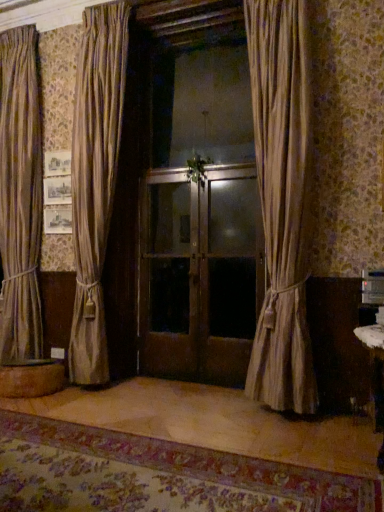
Image resolution: width=384 pixels, height=512 pixels. What do you see at coordinates (199, 273) in the screenshot?
I see `wooden door at center` at bounding box center [199, 273].

The height and width of the screenshot is (512, 384). What are the coordinates of `matte brown curtain at center, the first curtain from the left` in the screenshot? It's located at (95, 179).

Measure the distance between point (286, 92) and camera.

Point (286, 92) and camera are 9.47 feet apart from each other.

You are a GUI agent. You are given a task and a screenshot of the screen. Output one action in this format:
    pyautogui.click(x=<x>, y=<y>)
    Task: Click on the wooden door at center
    The width and height of the screenshot is (384, 512).
    Given the screenshot: What is the action you would take?
    pyautogui.click(x=199, y=273)

What's the angular difference between matte brown curtain at center, the first curtain from the left, and silky beige curtain at center, which is the second curtain in back-to-front order,'s facing directions?

There is a 9.12-degree angle between the facing directions of matte brown curtain at center, the first curtain from the left, and silky beige curtain at center, which is the second curtain in back-to-front order.

Does matte brown curtain at center, placed as the second curtain when sorted from front to back, have a larger size compared to silky beige curtain at center, positioned as the 1th curtain in front-to-back order?

No, matte brown curtain at center, placed as the second curtain when sorted from front to back, is not bigger than silky beige curtain at center, positioned as the 1th curtain in front-to-back order.

Is matte brown curtain at center, the first curtain from the left, far away from silky beige curtain at center, marked as the 1th curtain in a right-to-left arrangement?

Yes.

Between matte brown curtain at center, the 2th curtain positioned from the right, and silky beige curtain at center, which is the second curtain in back-to-front order, which one has more height?

matte brown curtain at center, the 2th curtain positioned from the right.

Is wooden door at center surrounded by silky beige curtain at center, marked as the 1th curtain in a right-to-left arrangement?

No, wooden door at center is not surrounded by silky beige curtain at center, marked as the 1th curtain in a right-to-left arrangement.

How far apart are silky beige curtain at center, marked as the 1th curtain in a right-to-left arrangement, and wooden door at center?

silky beige curtain at center, marked as the 1th curtain in a right-to-left arrangement, is 29.46 inches from wooden door at center.

Does point (266, 83) appear closer or farther from the camera than point (245, 350)?

Point (266, 83).

Considering the sizes of objects silky beige curtain at center, which is the second curtain in back-to-front order, and wooden door at center in the image provided, who is taller, silky beige curtain at center, which is the second curtain in back-to-front order, or wooden door at center?

silky beige curtain at center, which is the second curtain in back-to-front order, is taller.

Between point (179, 364) and point (70, 360), which one is positioned in front?

The point (70, 360) is in front.

Is wooden door at center at the right side of matte brown curtain at center, the 2th curtain positioned from the right?

Yes.

Considering the sizes of wooden door at center and matte brown curtain at center, the first curtain from the left, in the image, is wooden door at center taller or shorter than matte brown curtain at center, the first curtain from the left,?

In the image, wooden door at center appears to be shorter than matte brown curtain at center, the first curtain from the left.

Which is behind, wooden door at center or matte brown curtain at center, the 2th curtain positioned from the right?

wooden door at center is further from the camera.

Is point (177, 180) positioned before point (249, 227)?

No, it is not.

Would you say brown wooden screen door at center, the 1th screen door positioned from the left, contains wooden door at center?

That's correct, wooden door at center is inside brown wooden screen door at center, the 1th screen door positioned from the left.

The image size is (384, 512). What are the coordinates of `the 1st screen door below the wooden door at center (from a real-world perspective)` in the screenshot? It's located at (169, 275).

Is brown wooden screen door at center, the 2th screen door viewed from the right, smaller than matte wooden screen door at center, acting as the first screen door starting from the right?

Incorrect, brown wooden screen door at center, the 2th screen door viewed from the right, is not smaller in size than matte wooden screen door at center, acting as the first screen door starting from the right.

Are brown wooden screen door at center, the 2th screen door viewed from the right, and matte wooden screen door at center, acting as the first screen door starting from the right, located far from each other?

That's not correct — brown wooden screen door at center, the 2th screen door viewed from the right, is a little close to matte wooden screen door at center, acting as the first screen door starting from the right.

Considering the sizes of objects brown wooden screen door at center, the 1th screen door positioned from the left, and matte wooden screen door at center, acting as the first screen door starting from the right, in the image provided, who is wider, brown wooden screen door at center, the 1th screen door positioned from the left, or matte wooden screen door at center, acting as the first screen door starting from the right,?

brown wooden screen door at center, the 1th screen door positioned from the left.

Which is more distant, (158, 355) or (209, 375)?

The point (158, 355) is behind.

From their relative heights in the image, would you say matte wooden screen door at center, the second screen door from the left, is taller or shorter than silky beige curtain at center, the 2th curtain in the left-to-right sequence?

matte wooden screen door at center, the second screen door from the left, is shorter than silky beige curtain at center, the 2th curtain in the left-to-right sequence.

Which is behind, matte wooden screen door at center, acting as the first screen door starting from the right, or silky beige curtain at center, positioned as the 1th curtain in front-to-back order?

matte wooden screen door at center, acting as the first screen door starting from the right, is further away from the camera.

Is matte wooden screen door at center, the second screen door from the left, facing away from silky beige curtain at center, the 2th curtain in the left-to-right sequence?

No, matte wooden screen door at center, the second screen door from the left,'s orientation is not away from silky beige curtain at center, the 2th curtain in the left-to-right sequence.

Which is in front, point (250, 338) or point (300, 110)?

The point (300, 110) is closer.

Considering the relative positions of matte brown curtain at center, placed as the second curtain when sorted from front to back, and matte wooden screen door at center, acting as the first screen door starting from the right, in the image provided, is matte brown curtain at center, placed as the second curtain when sorted from front to back, behind matte wooden screen door at center, acting as the first screen door starting from the right,?

No, matte brown curtain at center, placed as the second curtain when sorted from front to back, is closer to the camera.

From the image's perspective, which one is positioned higher, matte brown curtain at center, placed as the second curtain when sorted from front to back, or matte wooden screen door at center, the second screen door from the left?

matte brown curtain at center, placed as the second curtain when sorted from front to back, is shown above in the image.

Are matte brown curtain at center, the 2th curtain positioned from the right, and matte wooden screen door at center, acting as the first screen door starting from the right, far apart?

matte brown curtain at center, the 2th curtain positioned from the right, is far away from matte wooden screen door at center, acting as the first screen door starting from the right.

Where is `curtain behind the silky beige curtain at center, positioned as the 1th curtain in front-to-back order`? curtain behind the silky beige curtain at center, positioned as the 1th curtain in front-to-back order is located at coordinates (95, 179).

Find the location of a particular element. The width and height of the screenshot is (384, 512). door below the silky beige curtain at center, the 2th curtain in the left-to-right sequence (from a real-world perspective) is located at coordinates (199, 273).

Estimate the real-world distances between objects in this image. Which object is closer to wooden round table at lower left, brown wooden screen door at center, the 1th screen door positioned from the left, or wooden door at center?

brown wooden screen door at center, the 1th screen door positioned from the left.

Which object lies further to the anchor point wooden door at center, silky beige curtain at center, the 2th curtain in the left-to-right sequence, or matte brown curtain at center, placed as the second curtain when sorted from front to back?

matte brown curtain at center, placed as the second curtain when sorted from front to back, lies further to wooden door at center than the other object.

From the image, which object appears to be farther from silky beige curtain at center, marked as the 1th curtain in a right-to-left arrangement, matte wooden screen door at center, acting as the first screen door starting from the right, or wooden round table at lower left?

wooden round table at lower left.

Looking at this image, considering their positions, is wooden round table at lower left positioned closer to wooden door at center than matte wooden screen door at center, the second screen door from the left?

matte wooden screen door at center, the second screen door from the left.

Which object lies further to the anchor point matte wooden screen door at center, acting as the first screen door starting from the right, brown wooden screen door at center, the 1th screen door positioned from the left, or wooden door at center?

brown wooden screen door at center, the 1th screen door positioned from the left, is further to matte wooden screen door at center, acting as the first screen door starting from the right.

Looking at the image, which one is located closer to silky beige curtain at center, positioned as the 1th curtain in front-to-back order, brown wooden screen door at center, the 2th screen door viewed from the right, or wooden door at center?

The object closer to silky beige curtain at center, positioned as the 1th curtain in front-to-back order, is wooden door at center.

Based on their spatial positions, is matte wooden screen door at center, the second screen door from the left, or silky beige curtain at center, positioned as the 1th curtain in front-to-back order, further from matte brown curtain at center, placed as the second curtain when sorted from front to back?

The object further to matte brown curtain at center, placed as the second curtain when sorted from front to back, is silky beige curtain at center, positioned as the 1th curtain in front-to-back order.

When comparing their distances from matte brown curtain at center, positioned as the first curtain in back-to-front order, does matte wooden screen door at center, the second screen door from the left, or brown wooden screen door at center, the 2th screen door viewed from the right, seem closer?

brown wooden screen door at center, the 2th screen door viewed from the right, is closer to matte brown curtain at center, positioned as the first curtain in back-to-front order.

This screenshot has height=512, width=384. In order to click on screen door situated between wooden round table at lower left and matte wooden screen door at center, acting as the first screen door starting from the right, from left to right in this screenshot , I will do `click(169, 275)`.

Identify the location of door situated between wooden round table at lower left and matte wooden screen door at center, the second screen door from the left, from left to right. Image resolution: width=384 pixels, height=512 pixels. (199, 273).

Identify the location of screen door located between silky beige curtain at center, which is the second curtain in back-to-front order, and wooden door at center in the depth direction. The width and height of the screenshot is (384, 512). (231, 278).

Where is `door positioned between silky beige curtain at center, positioned as the 1th curtain in front-to-back order, and brown wooden screen door at center, the 1th screen door positioned from the left, from near to far`? The height and width of the screenshot is (512, 384). door positioned between silky beige curtain at center, positioned as the 1th curtain in front-to-back order, and brown wooden screen door at center, the 1th screen door positioned from the left, from near to far is located at coordinates coord(199,273).